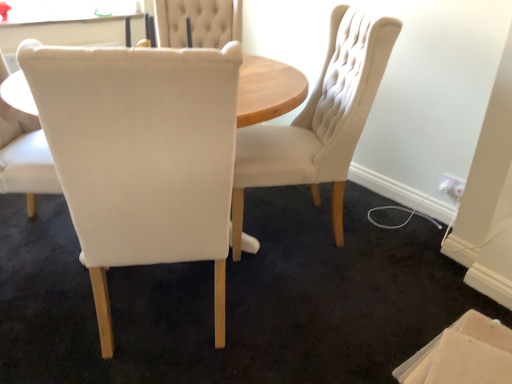
Where is `vacant area that lies between matte white chair at center, acting as the second chair starting from the left, and matte cream chair at center, arranged as the first chair when viewed from the right`? The image size is (512, 384). vacant area that lies between matte white chair at center, acting as the second chair starting from the left, and matte cream chair at center, arranged as the first chair when viewed from the right is located at coordinates (283, 288).